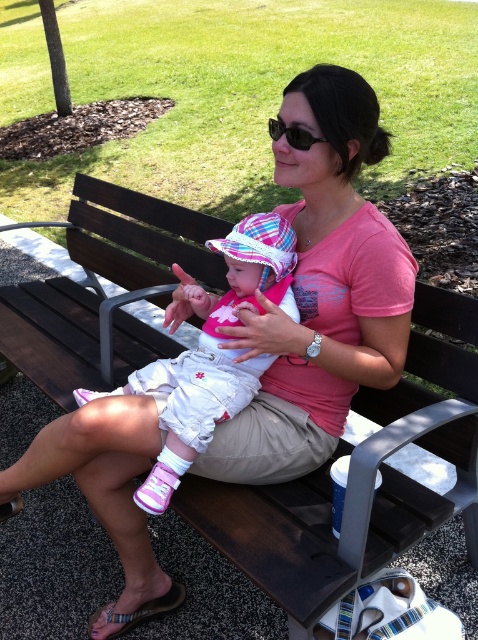
You are an architect designing a new park and want to place a bench in a specific location. You have a blueprint with coordinates. According to the image, where is the brown wooden bench at center located in 2D coordinates?

The brown wooden bench at center is located at the 2D coordinates point of (x=273, y=538).

You are a photographer taking a picture of the pink fabric baby at center and the black plastic sunglasses at center. Which object should you focus on first if you want to capture both in the frame?

The pink fabric baby at center is to the left of black plastic sunglasses at center, so focus on the pink fabric baby at center first to ensure both are in the frame.

You are a photographer taking a picture of the scene. You want to ensure that both the pink fabric baby at center and the black plastic sunglasses at center are clearly visible. Based on their positions, which object is closer to the camera and might require focusing on first?

The pink fabric baby at center is in front of the black plastic sunglasses at center, so the baby is closer to the camera and should be focused on first to ensure both are in clear view.